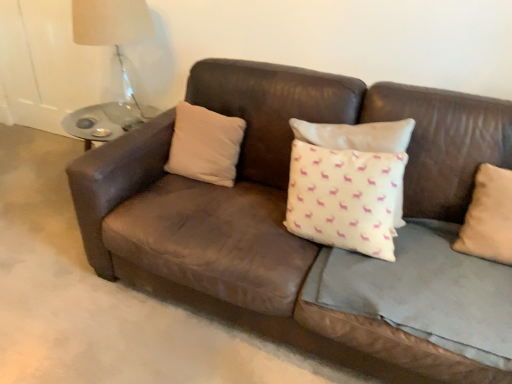
Question: Should I look upward or downward to see white matte pillow at center, which is the second pillow in front-to-back order?

Choices:
 (A) up
 (B) down

Answer: (A)

Question: Is beige fabric pillow at right, the 2th pillow positioned from the back, outside of translucent glass table lamp at upper left?

Choices:
 (A) yes
 (B) no

Answer: (A)

Question: Can you confirm if beige fabric pillow at right, the first pillow from the front, is wider than translucent glass table lamp at upper left?

Choices:
 (A) no
 (B) yes

Answer: (A)

Question: Is beige fabric pillow at right, the first pillow from the front, oriented towards translucent glass table lamp at upper left?

Choices:
 (A) no
 (B) yes

Answer: (A)

Question: From a real-world perspective, is beige fabric pillow at right, the 1th pillow viewed from the right, on top of translucent glass table lamp at upper left?

Choices:
 (A) no
 (B) yes

Answer: (A)

Question: Can you confirm if beige fabric pillow at right, the 1th pillow viewed from the right, is shorter than translucent glass table lamp at upper left?

Choices:
 (A) no
 (B) yes

Answer: (B)

Question: Does beige fabric pillow at right, the second pillow in the left-to-right sequence, come behind translucent glass table lamp at upper left?

Choices:
 (A) yes
 (B) no

Answer: (B)

Question: Are brown leather couch at center and beige fabric pillow at right, the 2th pillow positioned from the back, located far from each other?

Choices:
 (A) no
 (B) yes

Answer: (A)

Question: Are brown leather couch at center and beige fabric pillow at right, the first pillow from the front, beside each other?

Choices:
 (A) yes
 (B) no

Answer: (B)

Question: Is the position of brown leather couch at center less distant than that of beige fabric pillow at right, the 2th pillow positioned from the back?

Choices:
 (A) yes
 (B) no

Answer: (A)

Question: From the image's perspective, would you say brown leather couch at center is shown under beige fabric pillow at right, the 1th pillow viewed from the right?

Choices:
 (A) yes
 (B) no

Answer: (A)

Question: Can you confirm if brown leather couch at center is taller than beige fabric pillow at right, the 1th pillow viewed from the right?

Choices:
 (A) yes
 (B) no

Answer: (B)

Question: From a real-world perspective, is brown leather couch at center on top of beige fabric pillow at right, the 2th pillow positioned from the back?

Choices:
 (A) yes
 (B) no

Answer: (B)

Question: Is translucent glass table lamp at upper left positioned with its back to brown leather couch at center?

Choices:
 (A) yes
 (B) no

Answer: (B)